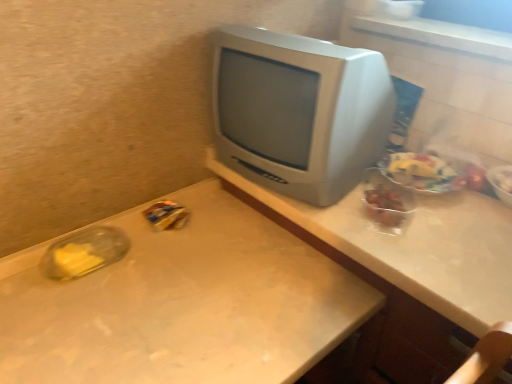
Find the location of a particular element. The image size is (512, 384). vacant space positioned to the left of translucent plastic container at right, which is counted as the third food, starting from the right is located at coordinates (340, 213).